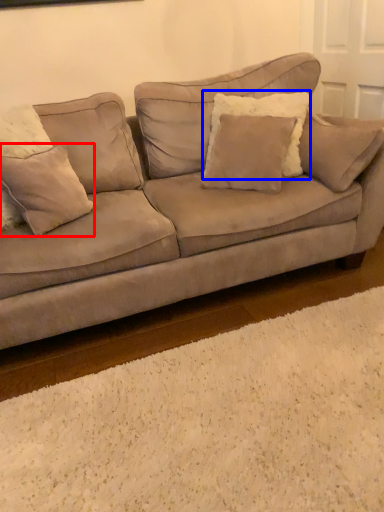
Question: Which of the following is the closest to the observer, pillow (highlighted by a red box) or pillow (highlighted by a blue box)?

Choices:
 (A) pillow
 (B) pillow

Answer: (A)